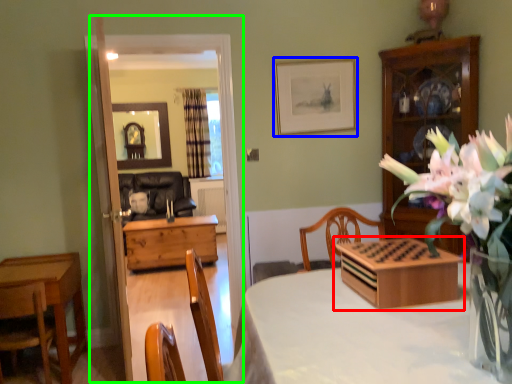
Question: Which object is positioned farthest from tableware (highlighted by a red box)? Select from picture frame (highlighted by a blue box) and glass door (highlighted by a green box).

Choices:
 (A) picture frame
 (B) glass door

Answer: (A)